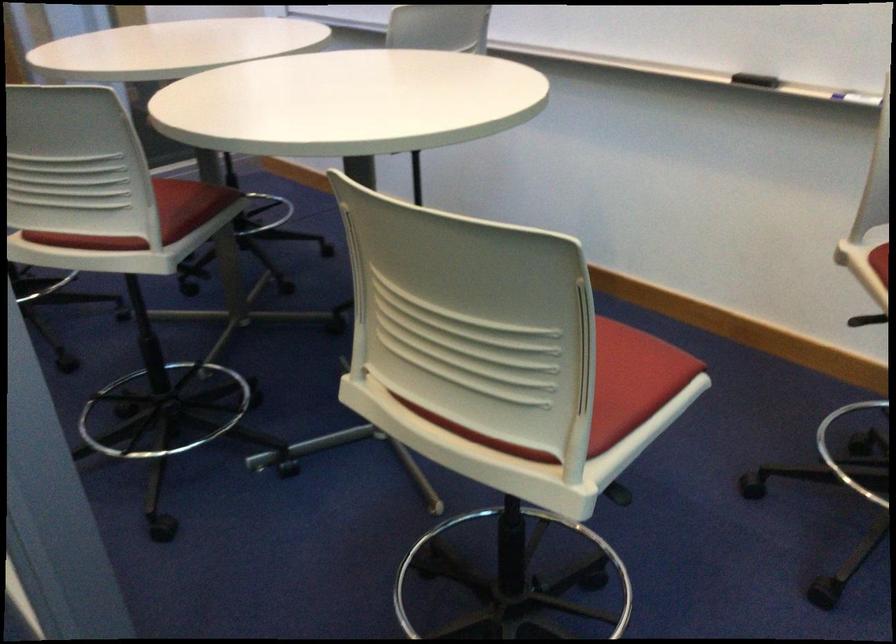
Where would you slid the black whiteboard eraser? Please return your answer as a coordinate pair (x, y).

(755, 80)